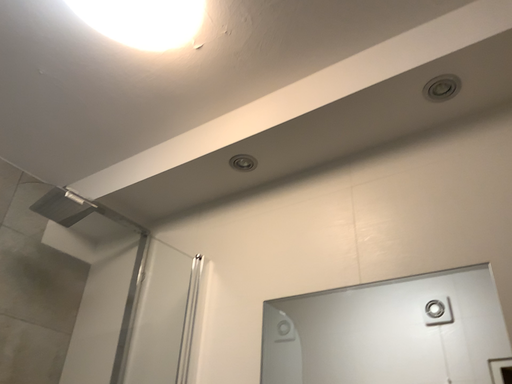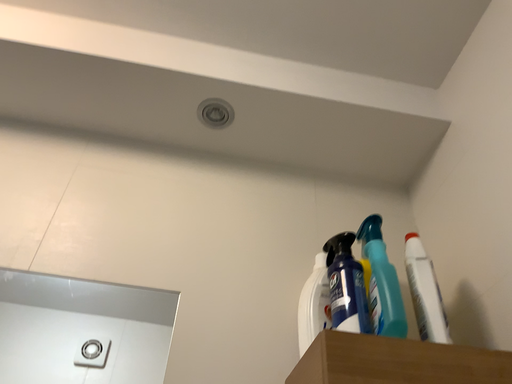
Question: Which way did the camera rotate in the video?

Choices:
 (A) rotated right
 (B) rotated left

Answer: (A)